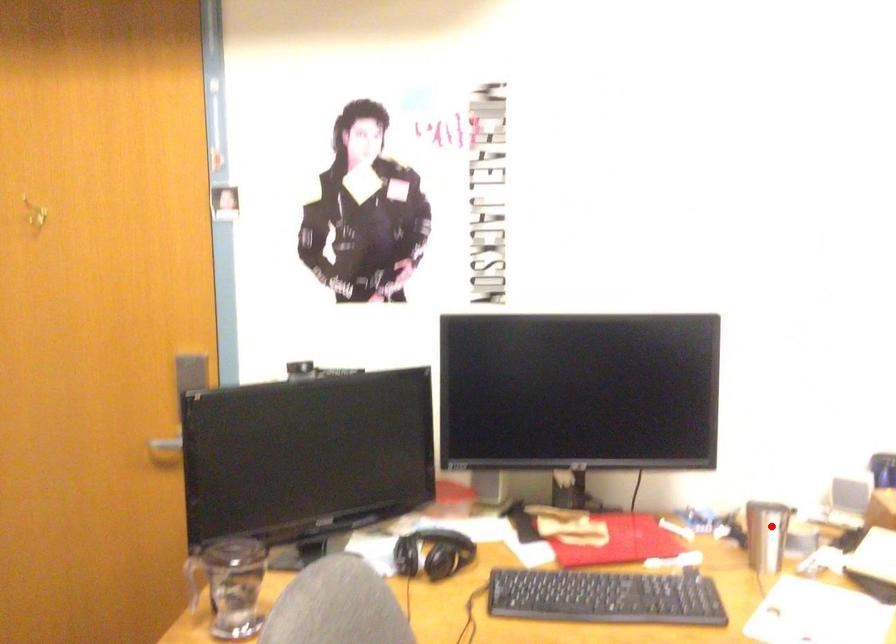
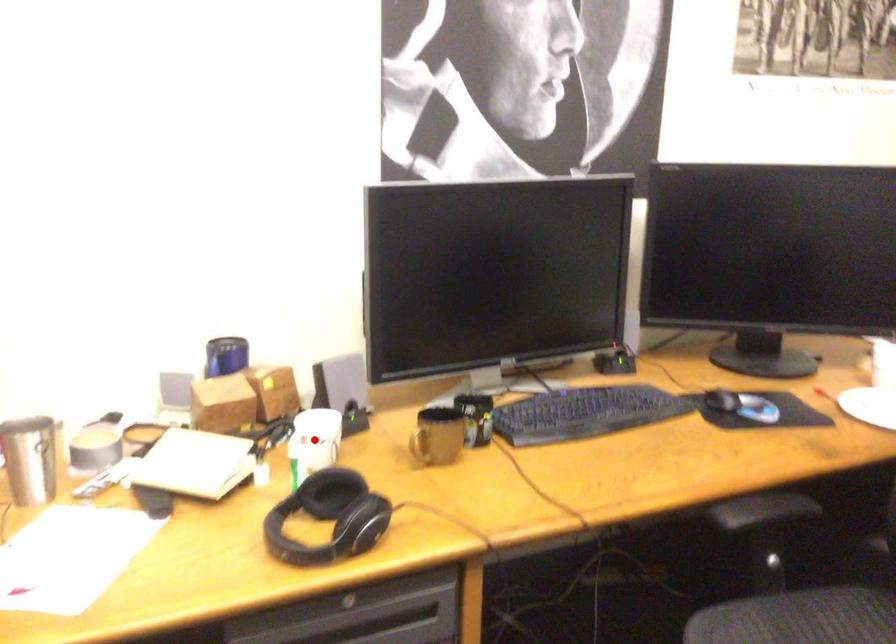
I am providing you with two images of the same scene from different viewpoints. A red point is marked on the first image and another point is marked on the second image. Is the marked point in image1 the same physical position as the marked point in image2?

No